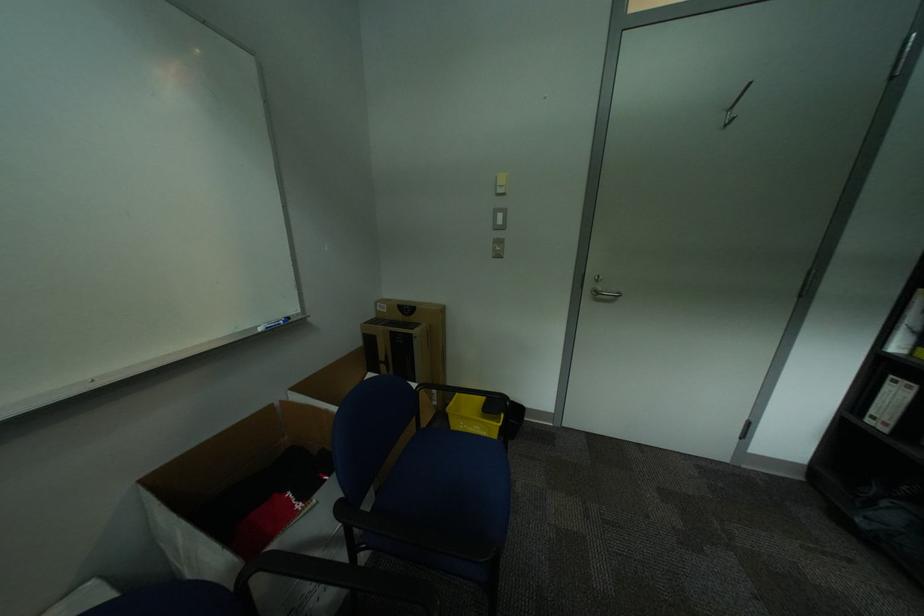
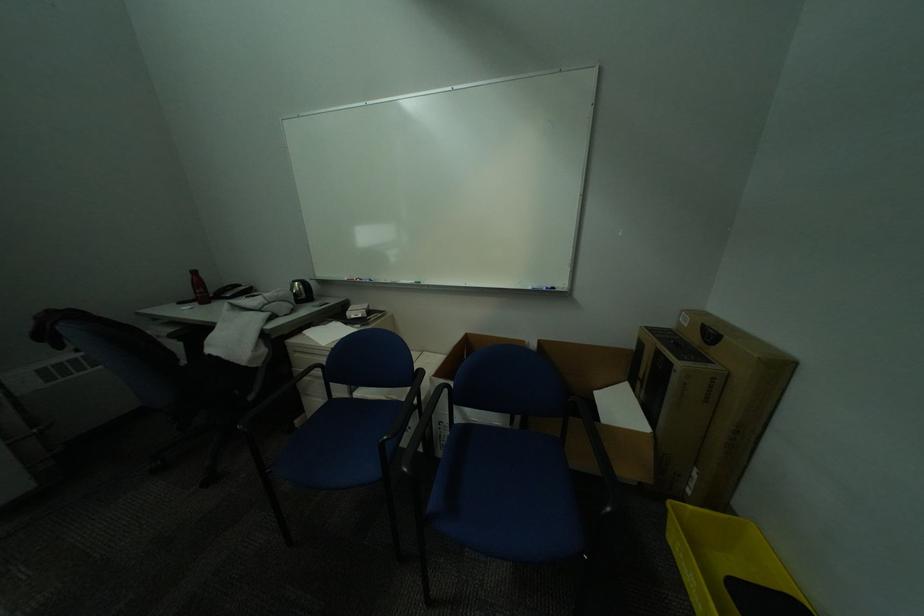
The point at (388,310) is marked in the first image. Where is the corresponding point in the second image?

(691, 321)